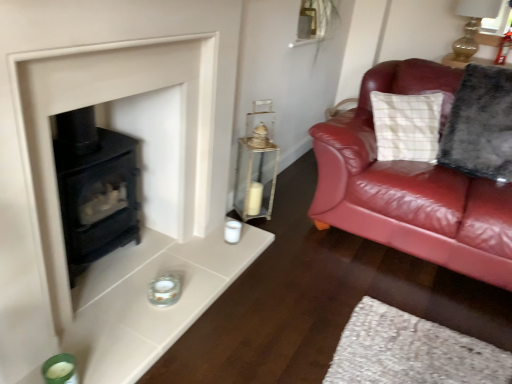
Identify the location of free space to the right of matte black stove at lower left. The image size is (512, 384). (301, 306).